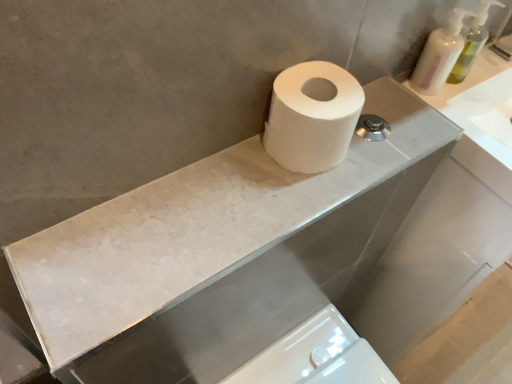
Where is `white marble counter top at upper center`? white marble counter top at upper center is located at coordinates (232, 262).

Find the location of a particular element. white matte toilet paper at center is located at coordinates (312, 117).

What do you see at coordinates (312, 117) in the screenshot? I see `white matte toilet paper at center` at bounding box center [312, 117].

The width and height of the screenshot is (512, 384). What do you see at coordinates (439, 55) in the screenshot?
I see `translucent plastic soap dispenser at upper right, which is the first soap dispenser from left to right` at bounding box center [439, 55].

Where is `white marble counter top at upper center`? The image size is (512, 384). white marble counter top at upper center is located at coordinates (232, 262).

Does white matte toilet paper at center appear on the left side of white marble counter top at upper center?

Incorrect, white matte toilet paper at center is not on the left side of white marble counter top at upper center.

From the image's perspective, which one is positioned higher, white matte toilet paper at center or white marble counter top at upper center?

white matte toilet paper at center is shown above in the image.

Would you say white matte toilet paper at center is outside white marble counter top at upper center?

white matte toilet paper at center lies outside white marble counter top at upper center's area.

From the picture: From a real-world perspective, is white matte toilet paper at center on top of white marble counter top at upper center?

Correct, in the physical world, white matte toilet paper at center is higher than white marble counter top at upper center.

Is translucent plastic soap dispenser at upper right, positioned as the 2th soap dispenser in right-to-left order, completely or partially outside of white glossy bidet at lower center?

Result: Yes, translucent plastic soap dispenser at upper right, positioned as the 2th soap dispenser in right-to-left order, is outside of white glossy bidet at lower center.

Consider the image. Who is more distant, translucent plastic soap dispenser at upper right, positioned as the 2th soap dispenser in right-to-left order, or white glossy bidet at lower center?

white glossy bidet at lower center is further away from the camera.

Considering the sizes of objects translucent plastic soap dispenser at upper right, which is the first soap dispenser from left to right, and white glossy bidet at lower center in the image provided, who is wider, translucent plastic soap dispenser at upper right, which is the first soap dispenser from left to right, or white glossy bidet at lower center?

white glossy bidet at lower center.

From the image's perspective, between white glossy bidet at lower center and translucent plastic soap dispenser at upper right, positioned as the 2th soap dispenser in right-to-left order, which one is located above?

translucent plastic soap dispenser at upper right, positioned as the 2th soap dispenser in right-to-left order.

Can you confirm if white glossy bidet at lower center is thinner than translucent plastic soap dispenser at upper right, positioned as the 2th soap dispenser in right-to-left order?

In fact, white glossy bidet at lower center might be wider than translucent plastic soap dispenser at upper right, positioned as the 2th soap dispenser in right-to-left order.

How many degrees apart are the facing directions of white glossy bidet at lower center and translucent plastic soap dispenser at upper right, which is the first soap dispenser from left to right?

1.4 degrees.

Does white glossy bidet at lower center lie in front of translucent plastic soap dispenser at upper right, which is the first soap dispenser from left to right?

No.

Is translucent plastic soap dispenser at upper right, which is the 2th soap dispenser from left to right, oriented away from translucent plastic soap dispenser at upper right, which is the first soap dispenser from left to right?

No, translucent plastic soap dispenser at upper right, which is the 2th soap dispenser from left to right,'s orientation is not away from translucent plastic soap dispenser at upper right, which is the first soap dispenser from left to right.

From the image's perspective, is translucent plastic soap dispenser at upper right, which is the 2th soap dispenser from left to right, located above or below translucent plastic soap dispenser at upper right, positioned as the 2th soap dispenser in right-to-left order?

Clearly, from the image's perspective, translucent plastic soap dispenser at upper right, which is the 2th soap dispenser from left to right, is above translucent plastic soap dispenser at upper right, positioned as the 2th soap dispenser in right-to-left order.

Does translucent plastic soap dispenser at upper right, which is the 2th soap dispenser from left to right, contain translucent plastic soap dispenser at upper right, which is the first soap dispenser from left to right?

No.

Which point is more distant from viewer, (455, 77) or (448, 49)?

Positioned behind is point (455, 77).

Which soap dispenser is the 1st one when counting from the right side of the white marble counter top at upper center? Please provide its 2D coordinates.

[(439, 55)]

Which object is positioned more to the right, white marble counter top at upper center or translucent plastic soap dispenser at upper right, positioned as the 2th soap dispenser in right-to-left order?

From the viewer's perspective, translucent plastic soap dispenser at upper right, positioned as the 2th soap dispenser in right-to-left order, appears more on the right side.

Is white marble counter top at upper center far away from translucent plastic soap dispenser at upper right, which is the first soap dispenser from left to right?

That's not correct — white marble counter top at upper center is a little close to translucent plastic soap dispenser at upper right, which is the first soap dispenser from left to right.

How distant is white marble counter top at upper center from translucent plastic soap dispenser at upper right, which is the first soap dispenser from left to right?

white marble counter top at upper center and translucent plastic soap dispenser at upper right, which is the first soap dispenser from left to right, are 16.79 inches apart.

What's the angular difference between translucent plastic soap dispenser at upper right, which is the 1th soap dispenser from right to left, and white glossy bidet at lower center's facing directions?

5.81 degrees separate the facing orientations of translucent plastic soap dispenser at upper right, which is the 1th soap dispenser from right to left, and white glossy bidet at lower center.

How much distance is there between translucent plastic soap dispenser at upper right, which is the 1th soap dispenser from right to left, and white glossy bidet at lower center?

A distance of 63.49 centimeters exists between translucent plastic soap dispenser at upper right, which is the 1th soap dispenser from right to left, and white glossy bidet at lower center.

Considering the sizes of objects translucent plastic soap dispenser at upper right, which is the 2th soap dispenser from left to right, and white glossy bidet at lower center in the image provided, who is bigger, translucent plastic soap dispenser at upper right, which is the 2th soap dispenser from left to right, or white glossy bidet at lower center?

Bigger between the two is white glossy bidet at lower center.

Which is more to the right, translucent plastic soap dispenser at upper right, which is the 2th soap dispenser from left to right, or white glossy bidet at lower center?

From the viewer's perspective, translucent plastic soap dispenser at upper right, which is the 2th soap dispenser from left to right, appears more on the right side.

Is white glossy bidet at lower center closer to the viewer compared to white matte toilet paper at center?

No, white glossy bidet at lower center is further to the viewer.

Does white glossy bidet at lower center appear on the right side of white matte toilet paper at center?

Indeed, white glossy bidet at lower center is positioned on the right side of white matte toilet paper at center.

Considering the positions of point (327, 379) and point (269, 132), is point (327, 379) closer or farther from the camera than point (269, 132)?

Point (327, 379) appears to be farther away from the viewer than point (269, 132).

This screenshot has width=512, height=384. I want to click on counter top located on the left of white matte toilet paper at center, so click(x=232, y=262).

Where is `soap dispenser that is the 1st object located above the white glossy bidet at lower center (from the image's perspective)`? soap dispenser that is the 1st object located above the white glossy bidet at lower center (from the image's perspective) is located at coordinates (439, 55).

Which object lies further to the anchor point white glossy bidet at lower center, translucent plastic soap dispenser at upper right, which is the 1th soap dispenser from right to left, or white marble counter top at upper center?

The object further to white glossy bidet at lower center is translucent plastic soap dispenser at upper right, which is the 1th soap dispenser from right to left.

From the picture: From the image, which object appears to be farther from white marble counter top at upper center, translucent plastic soap dispenser at upper right, which is the 2th soap dispenser from left to right, or white matte toilet paper at center?

translucent plastic soap dispenser at upper right, which is the 2th soap dispenser from left to right, lies further to white marble counter top at upper center than the other object.

Looking at the image, which one is located closer to translucent plastic soap dispenser at upper right, positioned as the 2th soap dispenser in right-to-left order, white glossy bidet at lower center or white matte toilet paper at center?

white matte toilet paper at center is closer to translucent plastic soap dispenser at upper right, positioned as the 2th soap dispenser in right-to-left order.

From the picture: Looking at the image, which one is located closer to white glossy bidet at lower center, translucent plastic soap dispenser at upper right, which is the 2th soap dispenser from left to right, or white matte toilet paper at center?

Based on the image, white matte toilet paper at center appears to be nearer to white glossy bidet at lower center.

When comparing their distances from white matte toilet paper at center, does white glossy bidet at lower center or translucent plastic soap dispenser at upper right, positioned as the 2th soap dispenser in right-to-left order, seem closer?

translucent plastic soap dispenser at upper right, positioned as the 2th soap dispenser in right-to-left order.

From the image, which object appears to be nearer to translucent plastic soap dispenser at upper right, which is the 2th soap dispenser from left to right, translucent plastic soap dispenser at upper right, which is the first soap dispenser from left to right, or white marble counter top at upper center?

The object closer to translucent plastic soap dispenser at upper right, which is the 2th soap dispenser from left to right, is translucent plastic soap dispenser at upper right, which is the first soap dispenser from left to right.

Which object lies nearer to the anchor point white marble counter top at upper center, translucent plastic soap dispenser at upper right, which is the first soap dispenser from left to right, or white glossy bidet at lower center?

Based on the image, white glossy bidet at lower center appears to be nearer to white marble counter top at upper center.

From the image, which object appears to be farther from translucent plastic soap dispenser at upper right, positioned as the 2th soap dispenser in right-to-left order, white matte toilet paper at center or translucent plastic soap dispenser at upper right, which is the 2th soap dispenser from left to right?

The object further to translucent plastic soap dispenser at upper right, positioned as the 2th soap dispenser in right-to-left order, is white matte toilet paper at center.

Find the location of `soap dispenser between white matte toilet paper at center and translucent plastic soap dispenser at upper right, which is the 1th soap dispenser from right to left`. soap dispenser between white matte toilet paper at center and translucent plastic soap dispenser at upper right, which is the 1th soap dispenser from right to left is located at coordinates (439, 55).

Locate an element on the screen. This screenshot has height=384, width=512. soap dispenser between translucent plastic soap dispenser at upper right, which is the 1th soap dispenser from right to left, and white glossy bidet at lower center, in the vertical direction is located at coordinates (439, 55).

Find the location of `toilet paper that lies between translucent plastic soap dispenser at upper right, positioned as the 2th soap dispenser in right-to-left order, and white glossy bidet at lower center from top to bottom`. toilet paper that lies between translucent plastic soap dispenser at upper right, positioned as the 2th soap dispenser in right-to-left order, and white glossy bidet at lower center from top to bottom is located at coordinates [x=312, y=117].

You are a GUI agent. You are given a task and a screenshot of the screen. Output one action in this format:
    pyautogui.click(x=<x>, y=<y>)
    Task: Click on the toilet paper between white marble counter top at upper center and translucent plastic soap dispenser at upper right, which is the 1th soap dispenser from right to left, from left to right
    
    Given the screenshot: What is the action you would take?
    pyautogui.click(x=312, y=117)